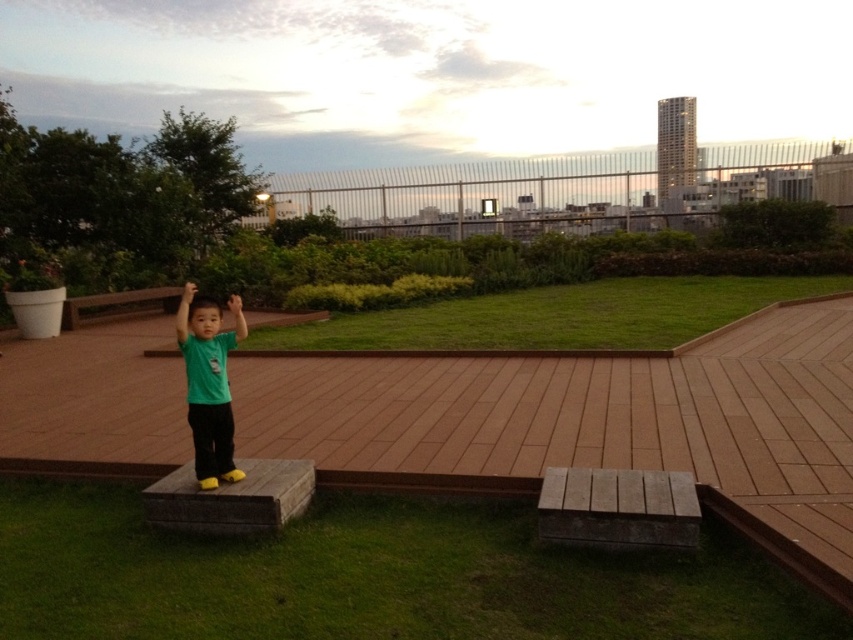
You are a photographer standing at the edge of the brown wood deck at center and want to take a photo of the green matte shirt at center. Which object is closer to your camera lens?

The brown wood deck at center is closer to the viewer than the green matte shirt at center, so the brown wood deck at center will appear closer to the camera lens in the photo.

Consider the image. You are standing at the point marked as point (590, 422) in the rooftop garden. What material are you standing on?

You are standing on the brown wood deck at center.

You are a parent trying to ensure your child stays safe on the rooftop garden. The brown wood deck at center and the green matte shirt at center are in view. Which object is wider?

The brown wood deck at center is wider than the green matte shirt at center.